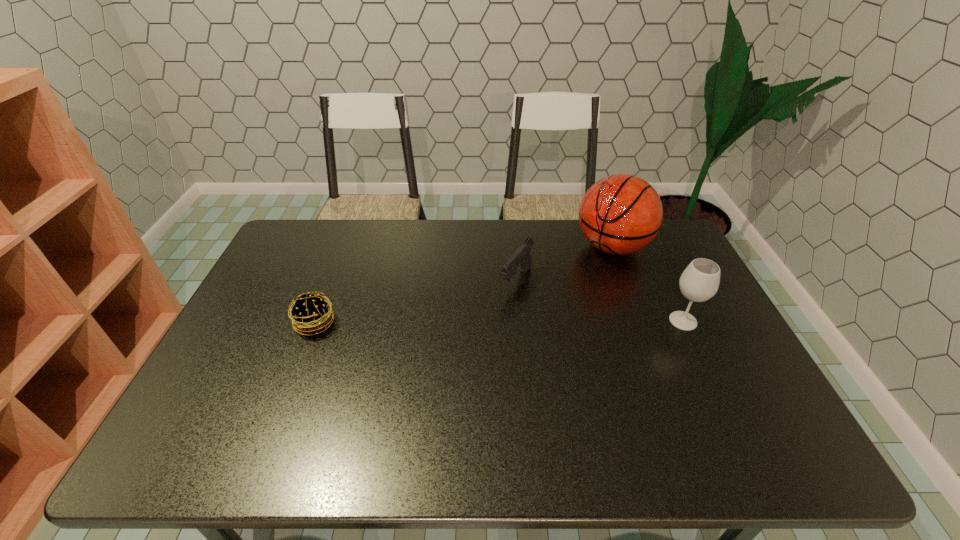
I want to click on free spot on the desktop that is between the leftmost object and the third shortest object and is positioned at the barrel of the second object from left to right, so click(482, 322).

The height and width of the screenshot is (540, 960). Identify the location of vacant space on the desktop that is between the patty and the second tallest object and is positioned on the side with spill of the tallest object. tap(505, 322).